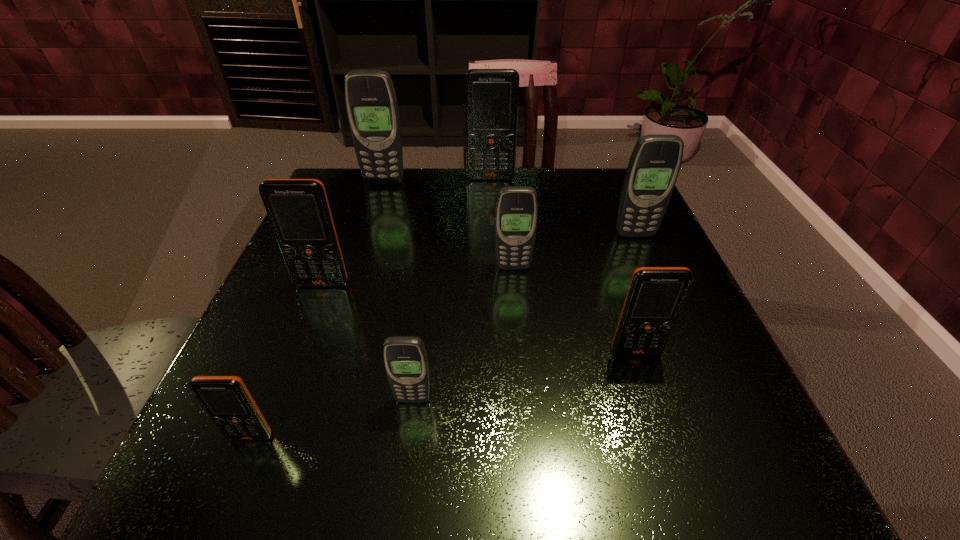
The image size is (960, 540). I want to click on the second orange cellular telephone from right to left, so click(x=491, y=95).

This screenshot has width=960, height=540. I want to click on the biggest orange cellular telephone, so click(491, 95).

Locate an element on the screen. the biggest gray cellular telephone is located at coordinates (371, 103).

This screenshot has height=540, width=960. I want to click on the leftmost gray cellular telephone, so click(371, 103).

What are the coordinates of `the fifth farthest object` in the screenshot? It's located at 298,209.

This screenshot has width=960, height=540. In order to click on the fourth nearest cellular telephone in this screenshot , I will do `click(298, 209)`.

The width and height of the screenshot is (960, 540). Find the location of `the third farthest object`. the third farthest object is located at coordinates (654, 165).

Where is `the sixth nearest cellular telephone`? the sixth nearest cellular telephone is located at coordinates (654, 165).

Find the location of `the fifth nearest cellular telephone`. the fifth nearest cellular telephone is located at coordinates (516, 214).

Locate an element on the screen. the second gray cellular telephone from right to left is located at coordinates (516, 214).